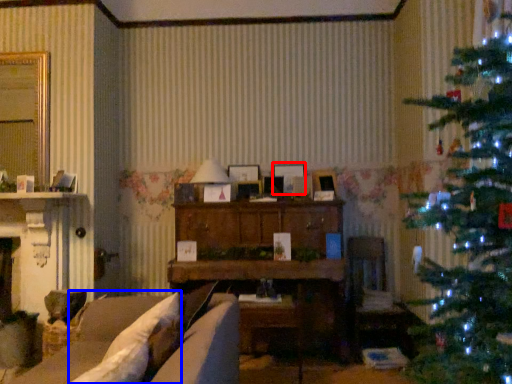
Question: Which object is further to the camera taking this photo, picture frame (highlighted by a red box) or pillow (highlighted by a blue box)?

Choices:
 (A) picture frame
 (B) pillow

Answer: (A)